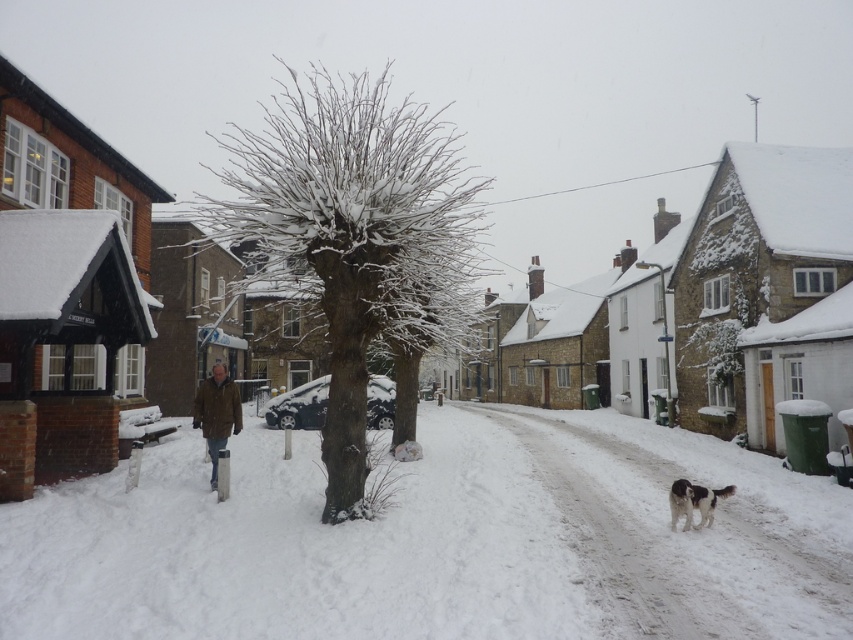
Question: Which of the following is the closest to the observer?

Choices:
 (A) (697, 488)
 (B) (403, 186)

Answer: (B)

Question: Can you confirm if snow-covered bark tree at center is positioned to the right of white fluffy dog at lower right?

Choices:
 (A) no
 (B) yes

Answer: (A)

Question: Which is farther from the snow-covered bark tree at center?

Choices:
 (A) white fluffy dog at lower right
 (B) white fluffy snow at center

Answer: (A)

Question: Observing the image, what is the correct spatial positioning of white fluffy snow at center in reference to white fluffy dog at lower right?

Choices:
 (A) below
 (B) above

Answer: (A)

Question: Which of these objects is positioned farthest from the white fluffy snow at center?

Choices:
 (A) white fluffy dog at lower right
 (B) snow-covered bark tree at center

Answer: (B)

Question: Does white fluffy snow at center appear on the right side of white fluffy dog at lower right?

Choices:
 (A) no
 (B) yes

Answer: (A)